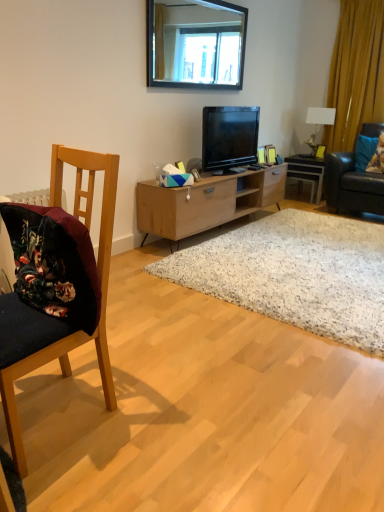
Question: Are blue fabric pillow at right, placed as the 1th pillow when sorted from left to right, and black glass mirror at upper center far apart?

Choices:
 (A) no
 (B) yes

Answer: (B)

Question: Is blue fabric pillow at right, the 2th pillow viewed from the right, oriented away from black glass mirror at upper center?

Choices:
 (A) yes
 (B) no

Answer: (B)

Question: Is blue fabric pillow at right, the 2th pillow viewed from the right, outside of black glass mirror at upper center?

Choices:
 (A) yes
 (B) no

Answer: (A)

Question: Considering the relative sizes of blue fabric pillow at right, the 2th pillow viewed from the right, and black glass mirror at upper center in the image provided, is blue fabric pillow at right, the 2th pillow viewed from the right, wider than black glass mirror at upper center?

Choices:
 (A) no
 (B) yes

Answer: (B)

Question: Is blue fabric pillow at right, placed as the 1th pillow when sorted from left to right, aimed at black glass mirror at upper center?

Choices:
 (A) no
 (B) yes

Answer: (A)

Question: Is velvet dark blue chair at left in front of or behind light wood cabinet at center in the image?

Choices:
 (A) front
 (B) behind

Answer: (A)

Question: From a real-world perspective, is velvet dark blue chair at left above or below light wood cabinet at center?

Choices:
 (A) below
 (B) above

Answer: (B)

Question: In terms of height, does velvet dark blue chair at left look taller or shorter compared to light wood cabinet at center?

Choices:
 (A) tall
 (B) short

Answer: (A)

Question: Considering the positions of point (104, 384) and point (160, 188), is point (104, 384) closer or farther from the camera than point (160, 188)?

Choices:
 (A) closer
 (B) farther

Answer: (A)

Question: Based on their sizes in the image, would you say wooden picture frame at upper center is bigger or smaller than yellow fabric curtain at right?

Choices:
 (A) small
 (B) big

Answer: (A)

Question: In the image, is wooden picture frame at upper center on the left side or the right side of yellow fabric curtain at right?

Choices:
 (A) left
 (B) right

Answer: (A)

Question: In the image, is wooden picture frame at upper center positioned in front of or behind yellow fabric curtain at right?

Choices:
 (A) front
 (B) behind

Answer: (B)

Question: From the image's perspective, relative to yellow fabric curtain at right, is wooden picture frame at upper center above or below?

Choices:
 (A) below
 (B) above

Answer: (A)

Question: Considering the positions of white speckled rug at center and light wood cabinet at center in the image, is white speckled rug at center bigger or smaller than light wood cabinet at center?

Choices:
 (A) big
 (B) small

Answer: (B)

Question: From a real-world perspective, is white speckled rug at center positioned above or below light wood cabinet at center?

Choices:
 (A) below
 (B) above

Answer: (A)